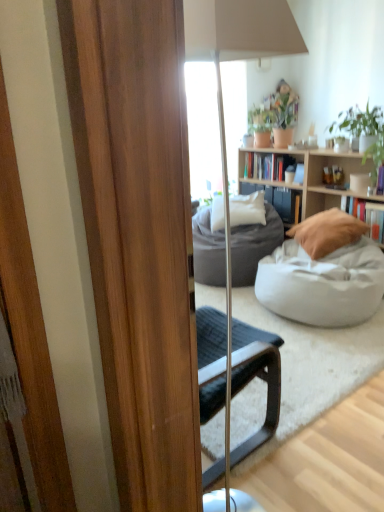
Question: Considering the relative positions of beige fabric pillow at center-right, arranged as the first pillow when viewed from the right, and dark gray fabric studio couch at center, the 1th studio couch viewed from the back, in the image provided, is beige fabric pillow at center-right, arranged as the first pillow when viewed from the right, behind dark gray fabric studio couch at center, the 1th studio couch viewed from the back,?

Choices:
 (A) yes
 (B) no

Answer: (B)

Question: From the image's perspective, is beige fabric pillow at center-right, the 1th pillow viewed from the front, under dark gray fabric studio couch at center, the 1th studio couch viewed from the back?

Choices:
 (A) no
 (B) yes

Answer: (A)

Question: From the image's perspective, does beige fabric pillow at center-right, the 2th pillow viewed from the left, appear higher than dark gray fabric studio couch at center, which is the second studio couch from front to back?

Choices:
 (A) no
 (B) yes

Answer: (B)

Question: Considering the relative sizes of beige fabric pillow at center-right, the second pillow in the back-to-front sequence, and dark gray fabric studio couch at center, the 1th studio couch viewed from the back, in the image provided, is beige fabric pillow at center-right, the second pillow in the back-to-front sequence, bigger than dark gray fabric studio couch at center, the 1th studio couch viewed from the back,?

Choices:
 (A) yes
 (B) no

Answer: (B)

Question: Is beige fabric pillow at center-right, the 2th pillow viewed from the left, facing towards dark gray fabric studio couch at center, which is the second studio couch from front to back?

Choices:
 (A) no
 (B) yes

Answer: (A)

Question: In the image, is dark gray fabric studio couch at center, which is the second studio couch from front to back, positioned in front of or behind white soft pillow at center, the 2th pillow when ordered from right to left?

Choices:
 (A) behind
 (B) front

Answer: (B)

Question: From the image's perspective, is dark gray fabric studio couch at center, which is the second studio couch from front to back, positioned above or below white soft pillow at center, positioned as the 2th pillow in front-to-back order?

Choices:
 (A) above
 (B) below

Answer: (B)

Question: Would you say dark gray fabric studio couch at center, the 1th studio couch viewed from the back, is inside or outside white soft pillow at center, the 2th pillow when ordered from right to left?

Choices:
 (A) inside
 (B) outside

Answer: (B)

Question: From a real-world perspective, is dark gray fabric studio couch at center, which is the second studio couch from front to back, physically located above or below white soft pillow at center, marked as the 1th pillow in a back-to-front arrangement?

Choices:
 (A) above
 (B) below

Answer: (B)

Question: From their relative heights in the image, would you say hardcover book at right, the second book from the top, is taller or shorter than white soft pillow at center, marked as the 1th pillow in a back-to-front arrangement?

Choices:
 (A) tall
 (B) short

Answer: (B)

Question: Is point (357, 211) positioned closer to the camera than point (263, 218)?

Choices:
 (A) farther
 (B) closer

Answer: (B)

Question: From the image's perspective, is hardcover book at right, positioned as the first book in bottom-to-top order, above or below white soft pillow at center, positioned as the 2th pillow in front-to-back order?

Choices:
 (A) below
 (B) above

Answer: (A)

Question: Would you say hardcover book at right, the first book in the right-to-left sequence, is to the left or to the right of white soft pillow at center, marked as the 1th pillow in a back-to-front arrangement, in the picture?

Choices:
 (A) left
 (B) right

Answer: (B)

Question: In the image, is light wood bookcase at center positioned in front of or behind hardcover book at right, positioned as the 2th book in left-to-right order?

Choices:
 (A) front
 (B) behind

Answer: (A)

Question: Is light wood bookcase at center taller or shorter than hardcover book at right, which is the second book from back to front?

Choices:
 (A) tall
 (B) short

Answer: (A)